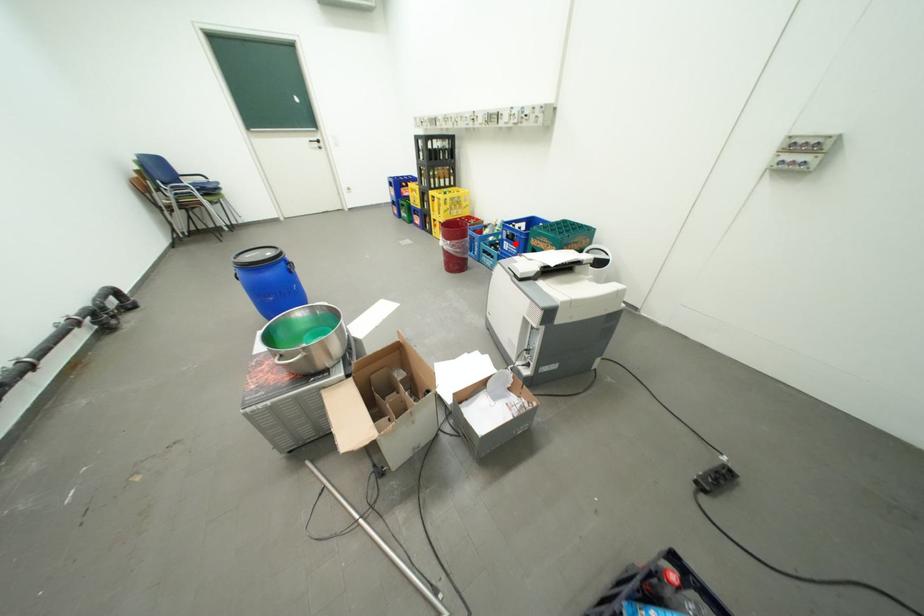
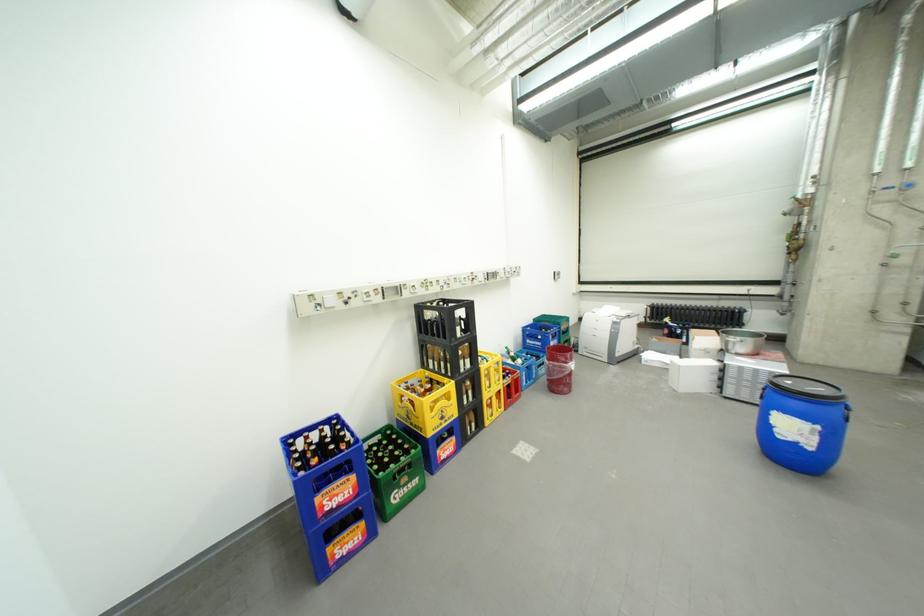
Where in the second image is the point corresponding to the highlighted location from the first image?

(562, 344)